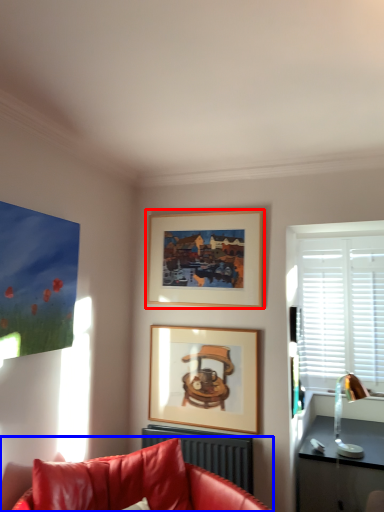
Question: Among these objects, which one is nearest to the camera, picture frame (highlighted by a red box) or studio couch (highlighted by a blue box)?

Choices:
 (A) picture frame
 (B) studio couch

Answer: (B)